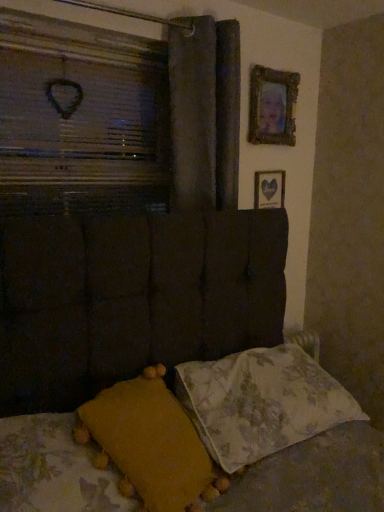
Question: Considering the relative positions of floral fabric pillow at lower right, which is the 1th pillow in right-to-left order, and gold-framed picture at upper right, the 1th picture frame in the top-to-bottom sequence, in the image provided, is floral fabric pillow at lower right, which is the 1th pillow in right-to-left order, to the left or to the right of gold-framed picture at upper right, the 1th picture frame in the top-to-bottom sequence,?

Choices:
 (A) left
 (B) right

Answer: (A)

Question: Is floral fabric pillow at lower right, acting as the second pillow starting from the left, in front of or behind gold-framed picture at upper right, which ranks as the second picture frame in bottom-to-top order, in the image?

Choices:
 (A) front
 (B) behind

Answer: (A)

Question: Estimate the real-world distances between objects in this image. Which object is closer to the gold-framed picture at upper right, the 1th picture frame in the top-to-bottom sequence?

Choices:
 (A) floral fabric pillow at lower right, which is the 1th pillow in right-to-left order
 (B) dark fabric curtain at upper center
 (C) mustard yellow fabric pillow at lower left, which is counted as the first pillow, starting from the left
 (D) wooden heart at upper left
 (E) wooden picture frame at upper right, placed as the 2th picture frame when sorted from top to bottom

Answer: (E)

Question: Which of these objects is positioned farthest from the wooden picture frame at upper right, placed as the 2th picture frame when sorted from top to bottom?

Choices:
 (A) dark fabric curtain at upper center
 (B) wooden heart at upper left
 (C) gold-framed picture at upper right, the 1th picture frame in the top-to-bottom sequence
 (D) mustard yellow fabric pillow at lower left, which appears as the 2th pillow when viewed from the right
 (E) floral fabric pillow at lower right, which is the 1th pillow in right-to-left order

Answer: (D)